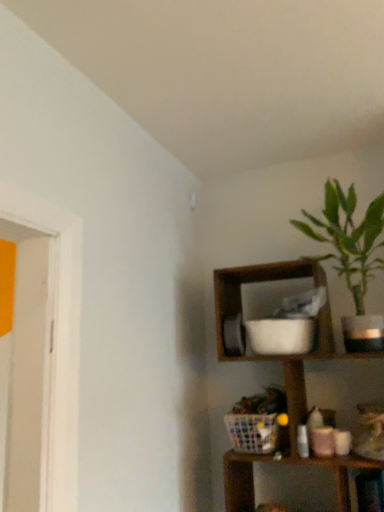
Question: Does wooden shelf at upper right have a lesser height compared to green leafy plant at upper right?

Choices:
 (A) no
 (B) yes

Answer: (A)

Question: Does wooden shelf at upper right contain green leafy plant at upper right?

Choices:
 (A) yes
 (B) no

Answer: (A)

Question: Would you consider wooden shelf at upper right to be distant from green leafy plant at upper right?

Choices:
 (A) yes
 (B) no

Answer: (B)

Question: Is wooden shelf at upper right facing away from green leafy plant at upper right?

Choices:
 (A) yes
 (B) no

Answer: (B)

Question: From the image's perspective, is wooden shelf at upper right located beneath green leafy plant at upper right?

Choices:
 (A) yes
 (B) no

Answer: (A)

Question: Is wooden shelf at upper right thinner than green leafy plant at upper right?

Choices:
 (A) no
 (B) yes

Answer: (A)

Question: Can you confirm if green leafy plant at upper right is smaller than wooden shelf at upper right?

Choices:
 (A) yes
 (B) no

Answer: (A)

Question: From the image's perspective, is green leafy plant at upper right located beneath wooden shelf at upper right?

Choices:
 (A) yes
 (B) no

Answer: (B)

Question: Is green leafy plant at upper right located outside wooden shelf at upper right?

Choices:
 (A) no
 (B) yes

Answer: (A)

Question: Is the depth of green leafy plant at upper right less than that of wooden shelf at upper right?

Choices:
 (A) no
 (B) yes

Answer: (A)

Question: Considering the relative positions of green leafy plant at upper right and wooden shelf at upper right in the image provided, is green leafy plant at upper right behind wooden shelf at upper right?

Choices:
 (A) no
 (B) yes

Answer: (B)

Question: Is green leafy plant at upper right oriented away from wooden shelf at upper right?

Choices:
 (A) yes
 (B) no

Answer: (A)

Question: From a real-world perspective, is wooden shelf at upper right positioned above or below green leafy plant at upper right?

Choices:
 (A) above
 (B) below

Answer: (B)